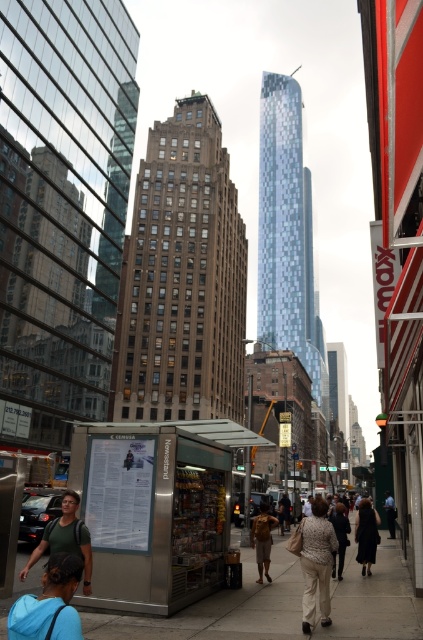
Question: Does blue fabric backpack at lower left have a greater width compared to brown leather jacket at center?

Choices:
 (A) no
 (B) yes

Answer: (B)

Question: Does patterned fabric pants at center appear under leather jacket at center?

Choices:
 (A) yes
 (B) no

Answer: (B)

Question: Which object appears farthest from the camera in this image?

Choices:
 (A) dark gray pants at center
 (B) patterned fabric pants at center
 (C) brown leather jacket at center

Answer: (A)

Question: Which object is closer to the camera taking this photo?

Choices:
 (A) brown leather jacket at center
 (B) dark fabric coat at lower right

Answer: (A)

Question: Does gray concrete sidewalk at center have a smaller size compared to light beige fabric coat at center?

Choices:
 (A) no
 (B) yes

Answer: (A)

Question: Among these objects, which one is nearest to the camera?

Choices:
 (A) brown leather jacket at center
 (B) leather jacket at center
 (C) dark gray pants at center
 (D) green fabric backpack at lower left

Answer: (D)